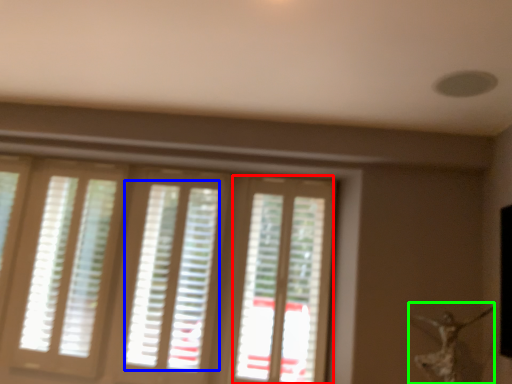
Question: Which is nearer to the screen door (highlighted by a red box)? blind (highlighted by a blue box) or woman (highlighted by a green box).

Choices:
 (A) blind
 (B) woman

Answer: (A)